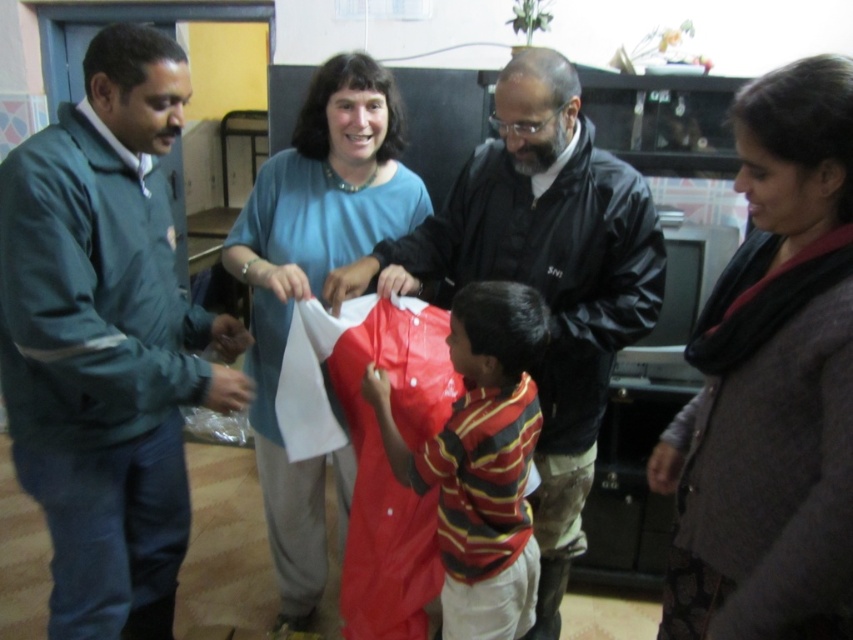
You are standing in the room and want to hand a small item to the person wearing the green fabric jacket at left without approaching them. Since you can only throw the item forward, can you ensure it reaches them before it might hit the black leather jacket at center?

The green fabric jacket at left is closer to the viewer than the black leather jacket at center, so throwing the item forward towards the green fabric jacket at left would reach them before it could hit the black leather jacket at center.

Based on the scene description, where is the dark gray sweater at center located in the image?

The dark gray sweater at center is located at point coordinates of 0.598 on the x axis and 0.910 on the y axis.

You are standing in the room and want to hand a small note to the person wearing the blue matte shirt at center and the red shiny shirt at center. Which one can you reach without moving closer?

You can reach the blue matte shirt at center first because it is closer to you than the red shiny shirt at center, which is further away.